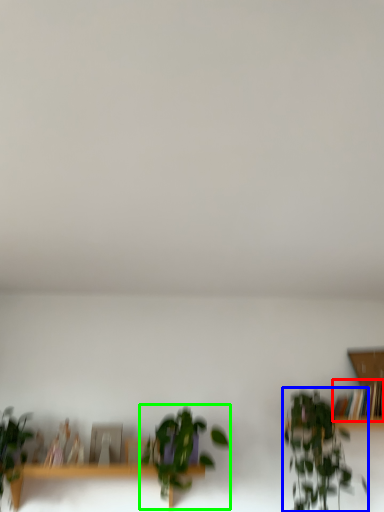
Question: Which object is the farthest from book (highlighted by a red box)? Choose among these: houseplant (highlighted by a blue box) or houseplant (highlighted by a green box).

Choices:
 (A) houseplant
 (B) houseplant

Answer: (B)